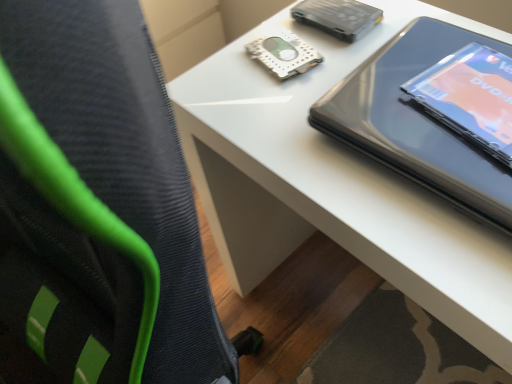
Question: Is matte black tablet at upper right bigger than white glossy table at upper right?

Choices:
 (A) no
 (B) yes

Answer: (A)

Question: Is matte black tablet at upper right smaller than white glossy table at upper right?

Choices:
 (A) no
 (B) yes

Answer: (B)

Question: Can you see matte black tablet at upper right touching white glossy table at upper right?

Choices:
 (A) yes
 (B) no

Answer: (B)

Question: Is matte black tablet at upper right completely or partially outside of white glossy table at upper right?

Choices:
 (A) no
 (B) yes

Answer: (A)

Question: Considering the relative sizes of matte black tablet at upper right and white glossy table at upper right in the image provided, is matte black tablet at upper right shorter than white glossy table at upper right?

Choices:
 (A) no
 (B) yes

Answer: (B)

Question: Considering the relative sizes of matte black tablet at upper right and white glossy table at upper right in the image provided, is matte black tablet at upper right wider than white glossy table at upper right?

Choices:
 (A) yes
 (B) no

Answer: (B)

Question: Is white glossy table at upper right at the right side of matte black tablet at upper right?

Choices:
 (A) yes
 (B) no

Answer: (B)

Question: From a real-world perspective, does white glossy table at upper right sit lower than matte black tablet at upper right?

Choices:
 (A) no
 (B) yes

Answer: (B)

Question: Is white glossy table at upper right aimed at matte black tablet at upper right?

Choices:
 (A) no
 (B) yes

Answer: (A)

Question: Does white glossy table at upper right have a larger size compared to matte black tablet at upper right?

Choices:
 (A) no
 (B) yes

Answer: (B)

Question: Is white glossy table at upper right directly adjacent to matte black tablet at upper right?

Choices:
 (A) yes
 (B) no

Answer: (B)

Question: Can you confirm if white glossy table at upper right is thinner than matte black tablet at upper right?

Choices:
 (A) yes
 (B) no

Answer: (B)

Question: Visually, is matte black tablet at upper right positioned to the left or to the right of white glossy table at upper right?

Choices:
 (A) right
 (B) left

Answer: (A)